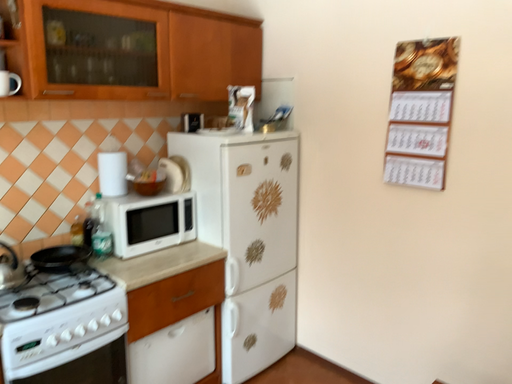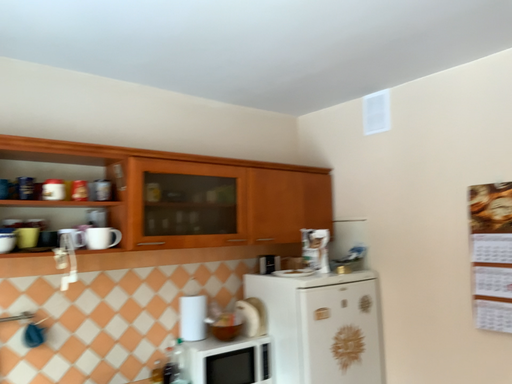
Question: Which way did the camera rotate in the video?

Choices:
 (A) rotated downward
 (B) rotated upward

Answer: (B)